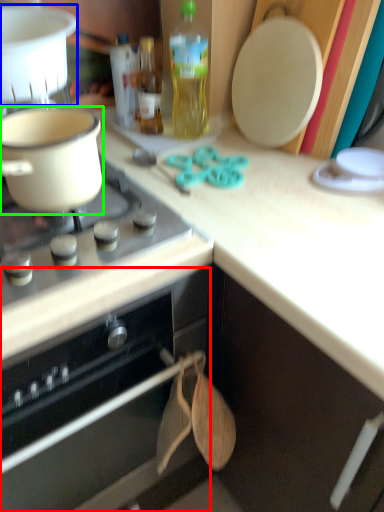
Question: Based on their relative distances, which object is farther from oven (highlighted by a red box)? Choose from kitchen appliance (highlighted by a blue box) and kitchen appliance (highlighted by a green box).

Choices:
 (A) kitchen appliance
 (B) kitchen appliance

Answer: (A)